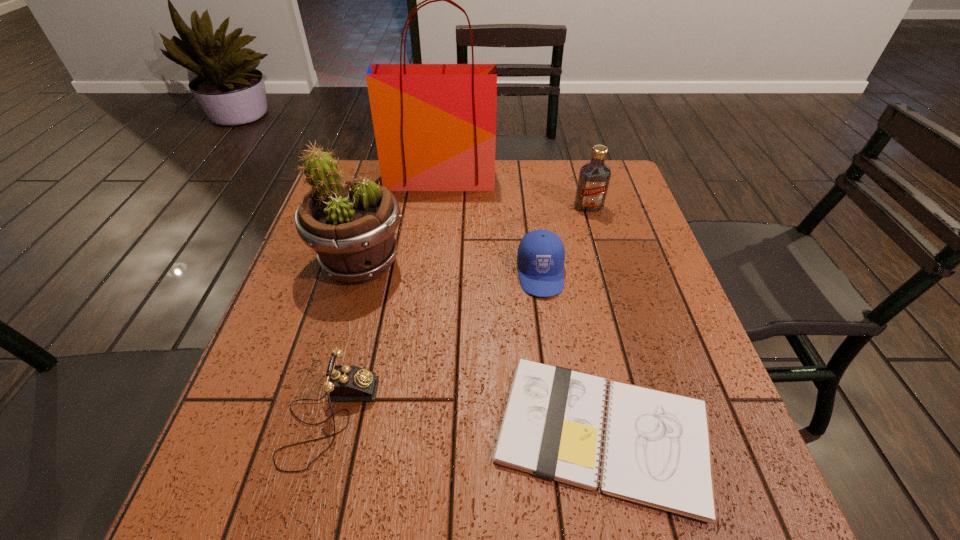
You are a GUI agent. You are given a task and a screenshot of the screen. Output one action in this format:
    pyautogui.click(x=<x>, y=<y>)
    Task: Click on the vodka at the right edge
    This screenshot has height=540, width=960.
    Given the screenshot: What is the action you would take?
    pyautogui.click(x=594, y=177)

The width and height of the screenshot is (960, 540). Find the location of `notepad present at the right edge`. notepad present at the right edge is located at coordinates (656, 452).

Locate an element on the screen. The height and width of the screenshot is (540, 960). object that is at the far left corner is located at coordinates (435, 124).

The height and width of the screenshot is (540, 960). Identify the location of object located in the far right corner section of the desktop. (594, 177).

This screenshot has width=960, height=540. I want to click on object located at the near right corner, so click(656, 452).

Locate an element on the screen. The image size is (960, 540). vacant space at the far edge of the desktop is located at coordinates (429, 201).

Locate an element on the screen. vacant space at the near edge of the desktop is located at coordinates (500, 485).

Identify the location of vacant space at the left edge of the desktop. (263, 355).

Image resolution: width=960 pixels, height=540 pixels. Find the location of `free spot at the right edge of the desktop`. free spot at the right edge of the desktop is located at coordinates (630, 380).

Find the location of a particular element. Image resolution: width=960 pixels, height=540 pixels. vacant space at the far right corner of the desktop is located at coordinates (618, 191).